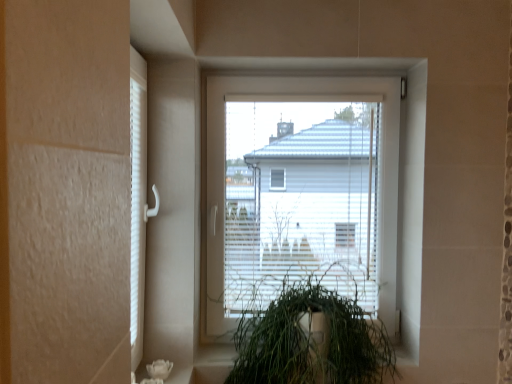
Question: Considering the relative sizes of green leafy plant at center and white plastic window at center in the image provided, is green leafy plant at center bigger than white plastic window at center?

Choices:
 (A) yes
 (B) no

Answer: (A)

Question: Are green leafy plant at center and white plastic window at center beside each other?

Choices:
 (A) yes
 (B) no

Answer: (B)

Question: Considering the relative positions of green leafy plant at center and white plastic window at center in the image provided, is green leafy plant at center in front of white plastic window at center?

Choices:
 (A) yes
 (B) no

Answer: (A)

Question: From the image's perspective, is green leafy plant at center under white plastic window at center?

Choices:
 (A) yes
 (B) no

Answer: (A)

Question: Is green leafy plant at center positioned with its back to white plastic window at center?

Choices:
 (A) no
 (B) yes

Answer: (B)

Question: Considering the relative sizes of green leafy plant at center and white plastic window at center in the image provided, is green leafy plant at center shorter than white plastic window at center?

Choices:
 (A) yes
 (B) no

Answer: (A)

Question: Considering the relative positions of white plastic window at center and green leafy plant at center in the image provided, is white plastic window at center in front of green leafy plant at center?

Choices:
 (A) no
 (B) yes

Answer: (A)

Question: Considering the relative sizes of white plastic window at center and green leafy plant at center in the image provided, is white plastic window at center wider than green leafy plant at center?

Choices:
 (A) yes
 (B) no

Answer: (B)

Question: From the image's perspective, is white plastic window at center on top of green leafy plant at center?

Choices:
 (A) no
 (B) yes

Answer: (B)

Question: Can you confirm if white plastic window at center is smaller than green leafy plant at center?

Choices:
 (A) yes
 (B) no

Answer: (A)

Question: Considering the relative sizes of white plastic window at center and green leafy plant at center in the image provided, is white plastic window at center shorter than green leafy plant at center?

Choices:
 (A) no
 (B) yes

Answer: (A)

Question: Is green leafy plant at center a part of white plastic window at center?

Choices:
 (A) no
 (B) yes

Answer: (A)

Question: Would you say white plastic window at center is to the left or to the right of green leafy plant at center in the picture?

Choices:
 (A) right
 (B) left

Answer: (A)